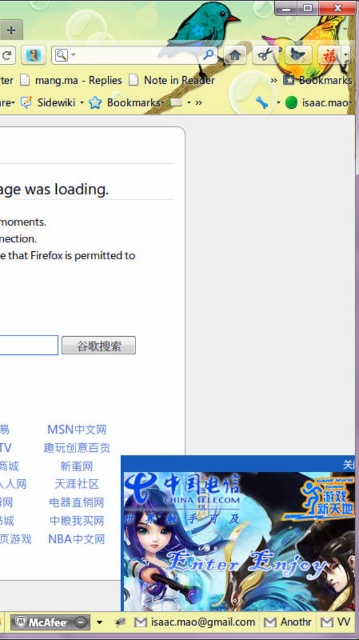
You are navigating a web browser and see two points on the screen. The first point is labeled as point (311, 38) and the second is point (207, 51). According to the browser interface, which point is closer to the top edge of the screen?

Point (311, 38) is closer to the top edge of the screen because it has a smaller y coordinate than point (207, 51), meaning it is positioned higher up on the screen.

You are trying to locate the matte plastic bird at upper right on your computer screen. What are its exact coordinates?

The matte plastic bird at upper right is located at coordinates point (309, 51).

You are trying to locate a specific object on your computer screen. You remember seeing a matte plastic bird at upper right near the browser bookmarks. Based on the coordinates provided, is the point at (309, 51) likely to be near the matte plastic bird at upper right?

Yes, the point at (309, 51) corresponds to the matte plastic bird at upper right, so it is near that object.